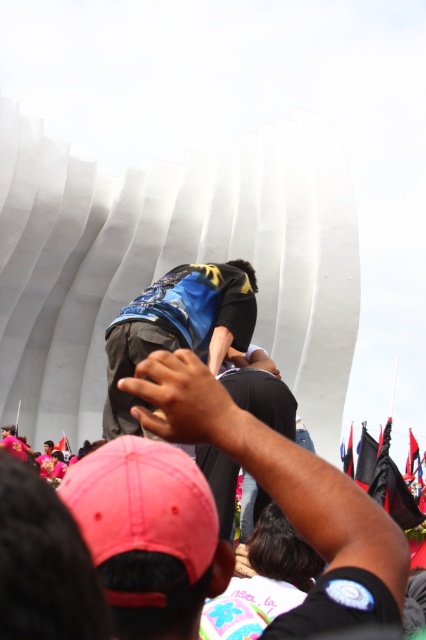
Question: Can you confirm if blue fabric shirt at center is thinner than black fabric flag at center?

Choices:
 (A) no
 (B) yes

Answer: (A)

Question: Which point appears closest to the camera in this image?

Choices:
 (A) (351, 472)
 (B) (152, 317)
 (C) (155, 365)

Answer: (C)

Question: Considering the relative positions of black matte shirt at center and black fabric flag at center in the image provided, where is black matte shirt at center located with respect to black fabric flag at center?

Choices:
 (A) left
 (B) right

Answer: (A)

Question: Which point is closer to the camera taking this photo?

Choices:
 (A) click(348, 461)
 (B) click(294, 492)
 (C) click(210, 300)

Answer: (B)

Question: Which of these objects is positioned closest to the black matte shirt at center?

Choices:
 (A) black fabric flag at center
 (B) blue fabric shirt at center

Answer: (B)

Question: Can you confirm if black matte shirt at center is positioned to the right of black fabric flag at center?

Choices:
 (A) no
 (B) yes

Answer: (A)